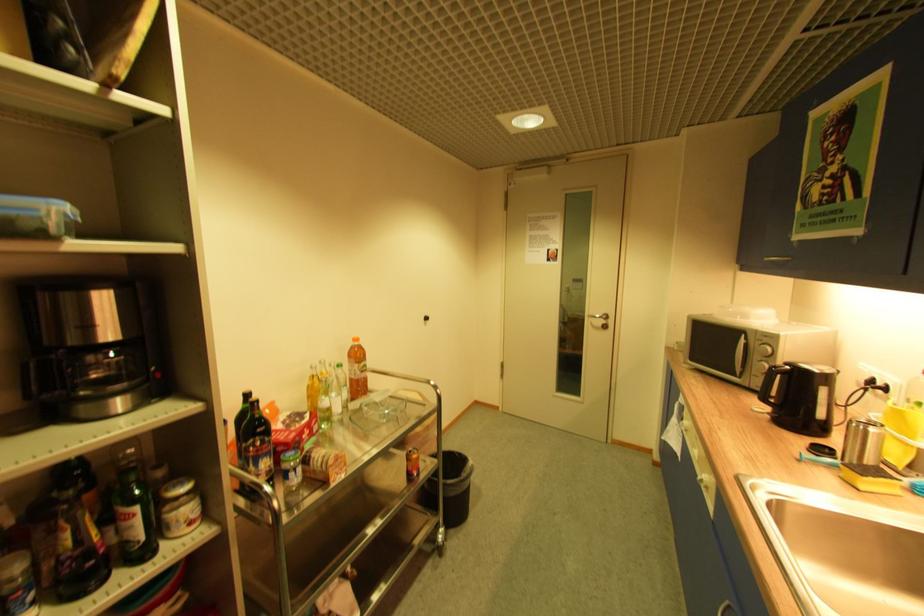
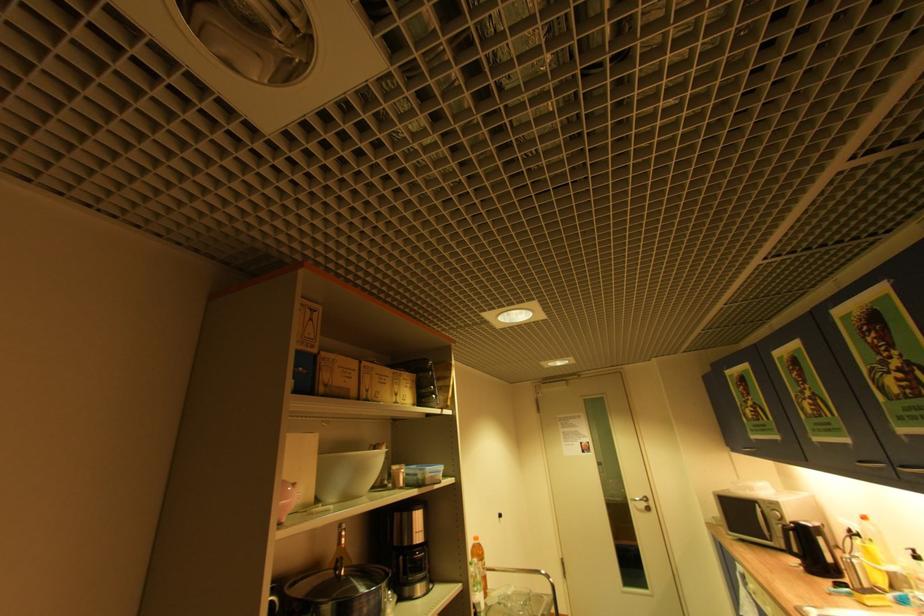
Locate, in the second image, the point that corresponds to pixel 358 350 in the first image.

(480, 548)